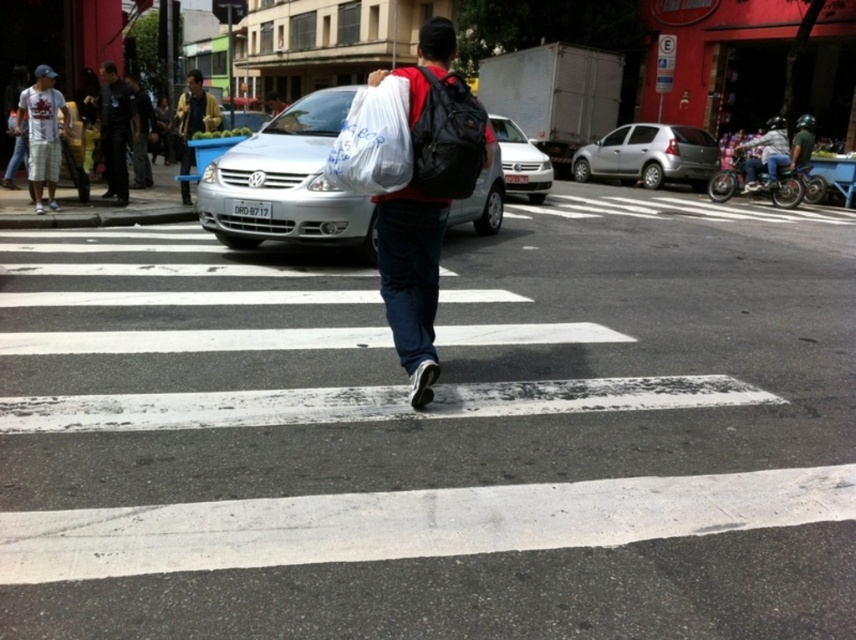
Question: Can you confirm if white cotton t-shirt at left is bigger than black leather jacket at upper left?

Choices:
 (A) yes
 (B) no

Answer: (B)

Question: Can you confirm if matte black backpack at center is thinner than white plastic bag at center?

Choices:
 (A) no
 (B) yes

Answer: (B)

Question: Which object is the farthest from the white cotton t-shirt at left?

Choices:
 (A) black fabric backpack at center
 (B) metallic silver helmet at upper right

Answer: (B)

Question: Which object is positioned closest to the silver metallic car at center?

Choices:
 (A) yellow fabric bag at upper left
 (B) metallic silver helmet at upper right
 (C) black leather jacket at upper left
 (D) black fabric backpack at center

Answer: (D)

Question: Which object is the closest to the white cotton t-shirt at left?

Choices:
 (A) silver metallic car at center
 (B) black leather jacket at upper left
 (C) black fabric backpack at center
 (D) white plastic bag at center

Answer: (B)

Question: Can you confirm if black fabric backpack at center is bigger than metallic silver helmet at upper right?

Choices:
 (A) yes
 (B) no

Answer: (B)